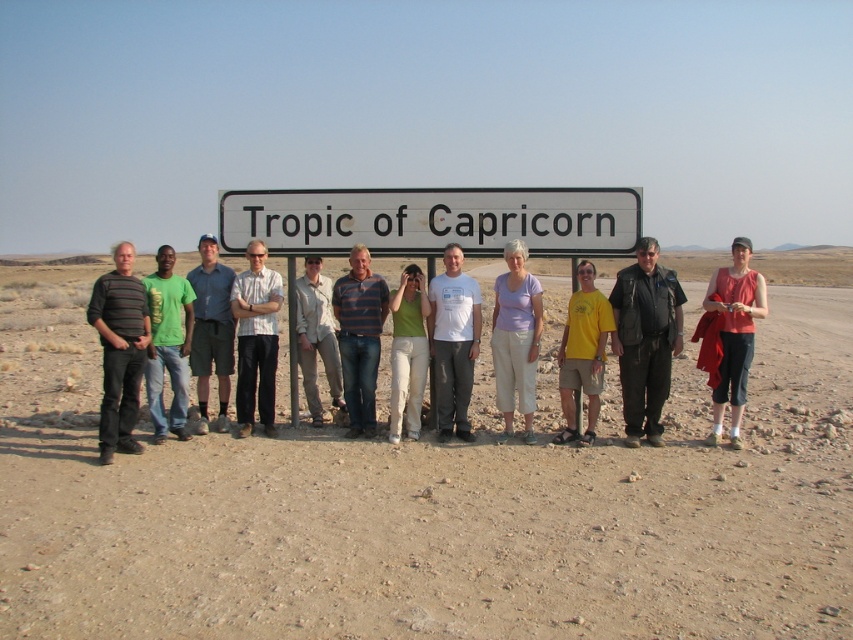
Can you confirm if white shirt at center is positioned to the right of matte red tank top at right?

No, white shirt at center is not to the right of matte red tank top at right.

Does white shirt at center have a lesser height compared to matte red tank top at right?

Yes, white shirt at center is shorter than matte red tank top at right.

Which is in front, point (251, 385) or point (764, 284)?

Positioned in front is point (764, 284).

The image size is (853, 640). Find the location of `white shirt at center`. white shirt at center is located at coordinates coord(256,339).

Consider the image. Can you confirm if light purple cotton shirt at center is shorter than green matte shirt at center?

No, light purple cotton shirt at center is not shorter than green matte shirt at center.

Between point (523, 349) and point (398, 291), which one is positioned in front?

Point (523, 349) is more forward.

Describe the element at coordinates (515, 339) in the screenshot. I see `light purple cotton shirt at center` at that location.

The height and width of the screenshot is (640, 853). What are the coordinates of `light purple cotton shirt at center` in the screenshot? It's located at (515, 339).

Who is shorter, matte black shirt at center or green t-shirt at center?

Standing shorter between the two is matte black shirt at center.

Does point (253, 264) lie behind point (175, 300)?

Yes, point (253, 264) is farther from viewer.

Who is more distant from viewer, (506, 436) or (148, 282)?

The point (506, 436) is behind.

This screenshot has height=640, width=853. What are the coordinates of `matte black shirt at center` in the screenshot? It's located at (659, 362).